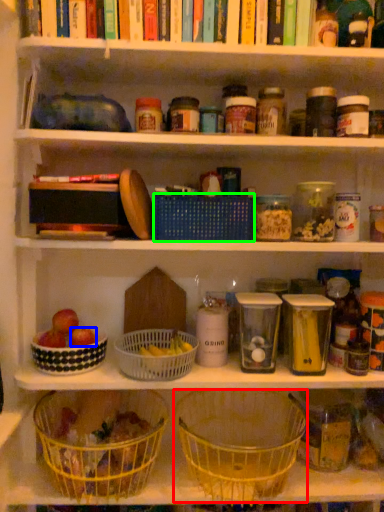
Question: Which object is positioned farthest from basket (highlighted by a red box)? Select from apple (highlighted by a blue box) and basket (highlighted by a green box).

Choices:
 (A) apple
 (B) basket

Answer: (B)